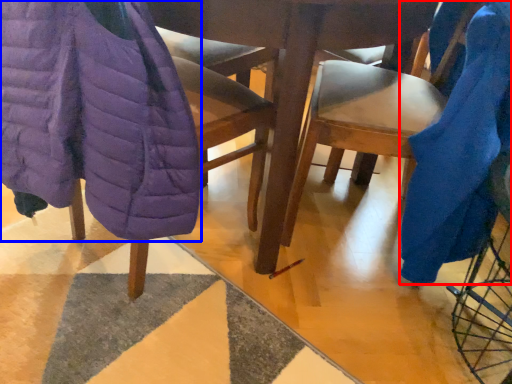
Question: Which point is closer to the camera, blanket (highlighted by a red box) or blanket (highlighted by a blue box)?

Choices:
 (A) blanket
 (B) blanket

Answer: (B)